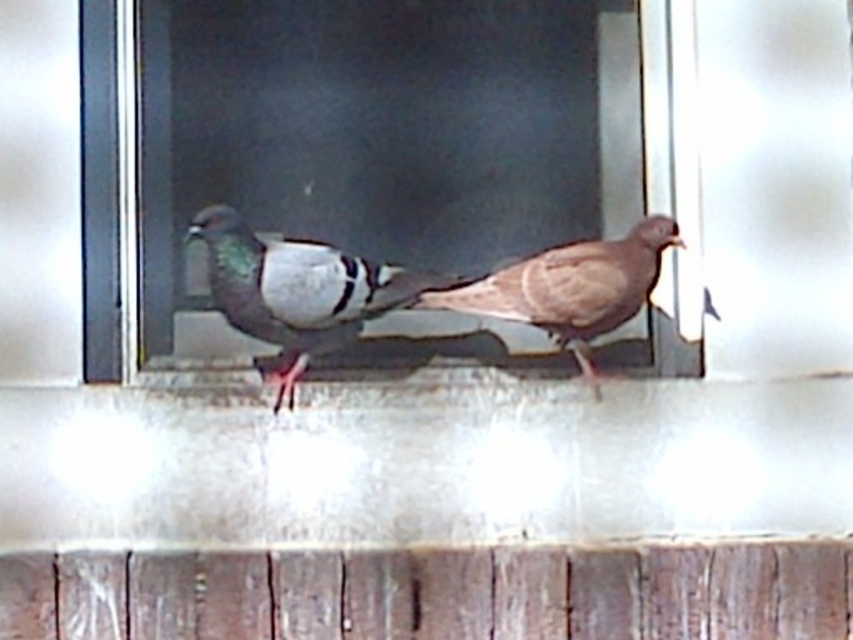
Question: Which object is the closest to the brown feathered pigeon at center?

Choices:
 (A) speckled feathered pigeon at center
 (B) clear glass window at center

Answer: (B)

Question: Is clear glass window at center smaller than speckled feathered pigeon at center?

Choices:
 (A) yes
 (B) no

Answer: (B)

Question: Is speckled feathered pigeon at center closer to the viewer compared to brown feathered pigeon at center?

Choices:
 (A) yes
 (B) no

Answer: (A)

Question: Is clear glass window at center closer to camera compared to brown feathered pigeon at center?

Choices:
 (A) yes
 (B) no

Answer: (A)

Question: Which is farther from the brown feathered pigeon at center?

Choices:
 (A) clear glass window at center
 (B) speckled feathered pigeon at center

Answer: (B)

Question: Among these points, which one is nearest to the camera?

Choices:
 (A) (585, 68)
 (B) (311, 292)
 (C) (581, 243)

Answer: (B)